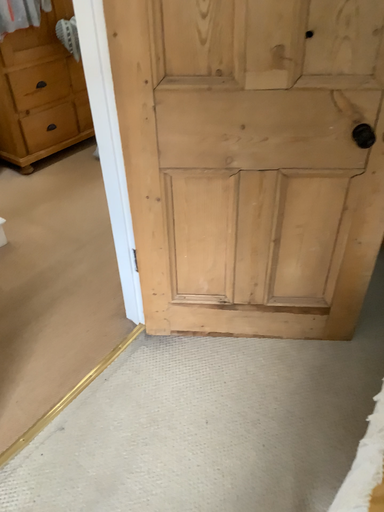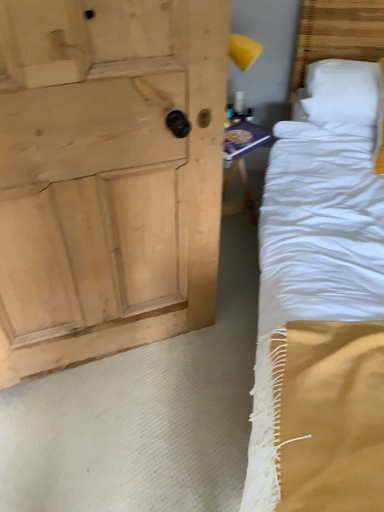
Question: Which way did the camera rotate in the video?

Choices:
 (A) rotated left
 (B) rotated right

Answer: (B)